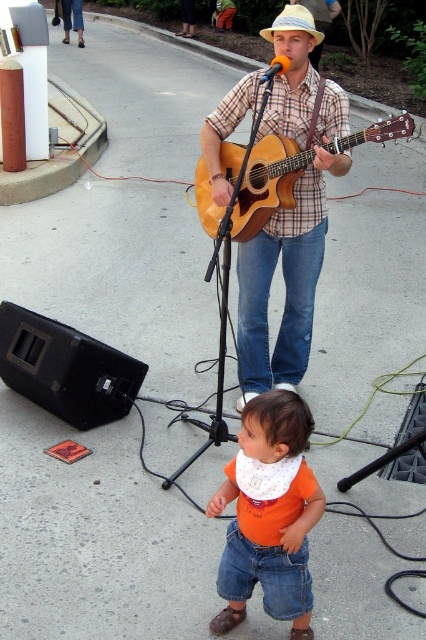
Question: Does orange cotton shirt at lower center have a lesser width compared to orange matte microphone at upper center?

Choices:
 (A) yes
 (B) no

Answer: (A)

Question: Does plaid shirt at center have a greater width compared to orange matte microphone at upper center?

Choices:
 (A) yes
 (B) no

Answer: (B)

Question: Is plaid shirt at center below light beige straw cowboy hat at center?

Choices:
 (A) yes
 (B) no

Answer: (A)

Question: Which point appears farthest from the camera in this image?

Choices:
 (A) (287, 150)
 (B) (279, 218)
 (C) (273, 470)

Answer: (B)

Question: Estimate the real-world distances between objects in this image. Which object is farther from the orange matte microphone at upper center?

Choices:
 (A) light beige straw cowboy hat at center
 (B) orange cotton shirt at lower center

Answer: (B)

Question: Which object is the closest to the plaid shirt at center?

Choices:
 (A) orange matte microphone at upper center
 (B) acoustic wood guitar at center
 (C) orange cotton shirt at lower center
 (D) light beige straw cowboy hat at center

Answer: (B)